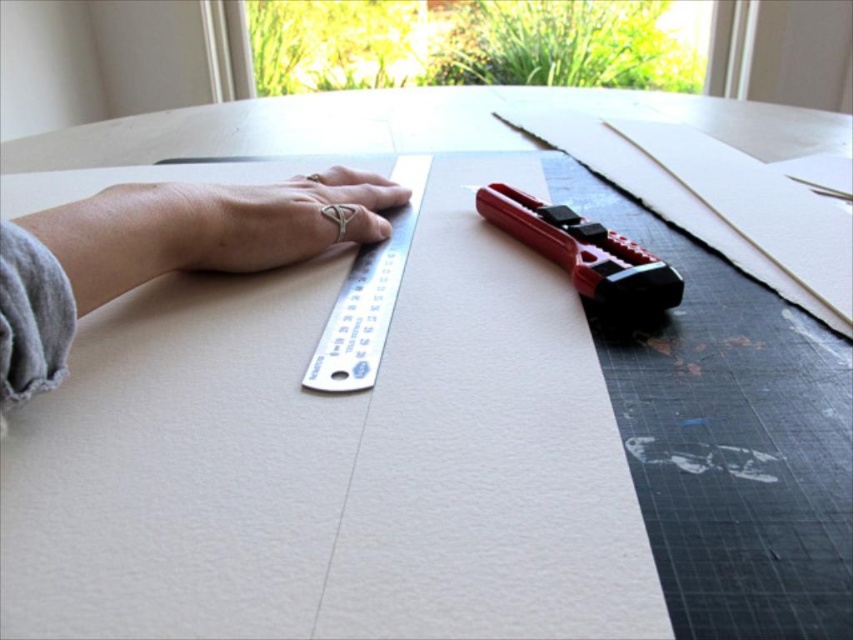
Question: Estimate the real-world distances between objects in this image. Which object is farther from the gold metallic ring at center?

Choices:
 (A) silver metallic ruler at center
 (B) silver metallic ruler at left
 (C) red plastic stapler at upper right

Answer: (C)

Question: Is silver metallic ruler at left above red plastic stapler at upper right?

Choices:
 (A) no
 (B) yes

Answer: (B)

Question: In this image, where is silver metallic ruler at left located relative to gold metallic ring at center?

Choices:
 (A) left
 (B) right

Answer: (A)

Question: Based on their relative distances, which object is farther from the gold metallic ring at center?

Choices:
 (A) silver metallic ruler at left
 (B) silver metallic ruler at center
 (C) red plastic stapler at upper right

Answer: (C)

Question: Does gold metallic ring at center have a greater width compared to silver metallic ruler at center?

Choices:
 (A) yes
 (B) no

Answer: (A)

Question: Which point is farther from the camera taking this photo?

Choices:
 (A) (633, 305)
 (B) (363, 346)

Answer: (A)